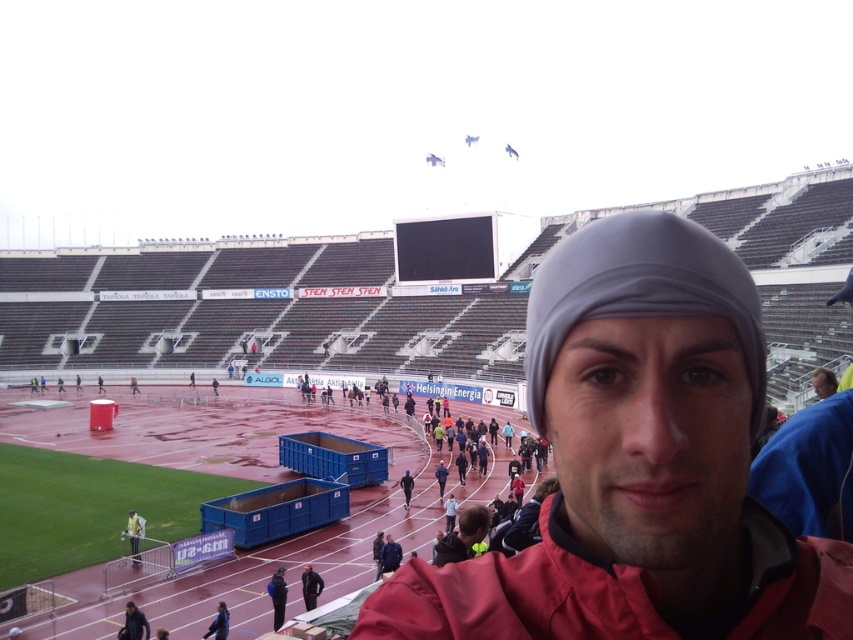
You are a photographer at the stadium and need to capture a photo of the black matte jacket at lower center without the red matte jacket at center blocking it. How should you adjust your position?

Move your camera position behind the black matte jacket at lower center so that it is no longer blocked by the red matte jacket at center, which is currently in front of it.

You are at the stadium and want to take a photo of the two points mentioned. Which point is farther away from you, point (315, 602) or point (218, 634)?

Point (315, 602) is behind point (218, 634), so it is farther away from you.

You are a photographer at the stadium and need to capture a wide shot of the stadium while including both the red jacket at lower center and the dark blue jacket at lower left in the frame. Considering their sizes, which jacket might require you to adjust your camera angle more to ensure it is fully visible?

The red jacket at lower center has a larger width than the dark blue jacket at lower left, so it might require adjusting the camera angle more to ensure it is fully visible.